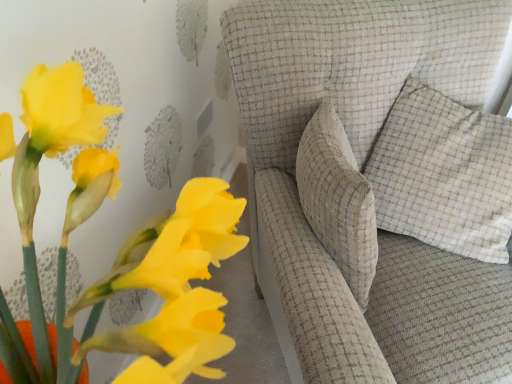
Question: Is beige checkered pillow at upper right inside textured beige sofa at center?

Choices:
 (A) no
 (B) yes

Answer: (B)

Question: Considering the relative positions of textured beige sofa at center and beige checkered pillow at upper right in the image provided, is textured beige sofa at center behind beige checkered pillow at upper right?

Choices:
 (A) no
 (B) yes

Answer: (A)

Question: Can you confirm if textured beige sofa at center is shorter than beige checkered pillow at upper right?

Choices:
 (A) no
 (B) yes

Answer: (A)

Question: Is the position of textured beige sofa at center less distant than that of beige checkered pillow at upper right?

Choices:
 (A) yes
 (B) no

Answer: (A)

Question: Can you confirm if textured beige sofa at center is bigger than beige checkered pillow at upper right?

Choices:
 (A) yes
 (B) no

Answer: (A)

Question: Is matte yellow flowers at lower left spatially inside beige checkered pillow at upper right, or outside of it?

Choices:
 (A) inside
 (B) outside

Answer: (B)

Question: Considering the positions of matte yellow flowers at lower left and beige checkered pillow at upper right in the image, is matte yellow flowers at lower left wider or thinner than beige checkered pillow at upper right?

Choices:
 (A) wide
 (B) thin

Answer: (A)

Question: Considering the positions of point (42, 87) and point (482, 228), is point (42, 87) closer or farther from the camera than point (482, 228)?

Choices:
 (A) farther
 (B) closer

Answer: (B)

Question: Is matte yellow flowers at lower left in front of or behind beige checkered pillow at upper right in the image?

Choices:
 (A) behind
 (B) front

Answer: (B)

Question: Considering the positions of matte yellow flowers at lower left and textured beige sofa at center in the image, is matte yellow flowers at lower left bigger or smaller than textured beige sofa at center?

Choices:
 (A) small
 (B) big

Answer: (A)

Question: Is matte yellow flowers at lower left situated inside textured beige sofa at center or outside?

Choices:
 (A) outside
 (B) inside

Answer: (A)

Question: Considering the positions of matte yellow flowers at lower left and textured beige sofa at center in the image, is matte yellow flowers at lower left wider or thinner than textured beige sofa at center?

Choices:
 (A) wide
 (B) thin

Answer: (B)

Question: Would you say matte yellow flowers at lower left is to the left or to the right of textured beige sofa at center in the picture?

Choices:
 (A) left
 (B) right

Answer: (A)

Question: Is beige checkered pillow at upper right spatially inside textured beige sofa at center, or outside of it?

Choices:
 (A) inside
 (B) outside

Answer: (A)

Question: In terms of size, does beige checkered pillow at upper right appear bigger or smaller than textured beige sofa at center?

Choices:
 (A) small
 (B) big

Answer: (A)